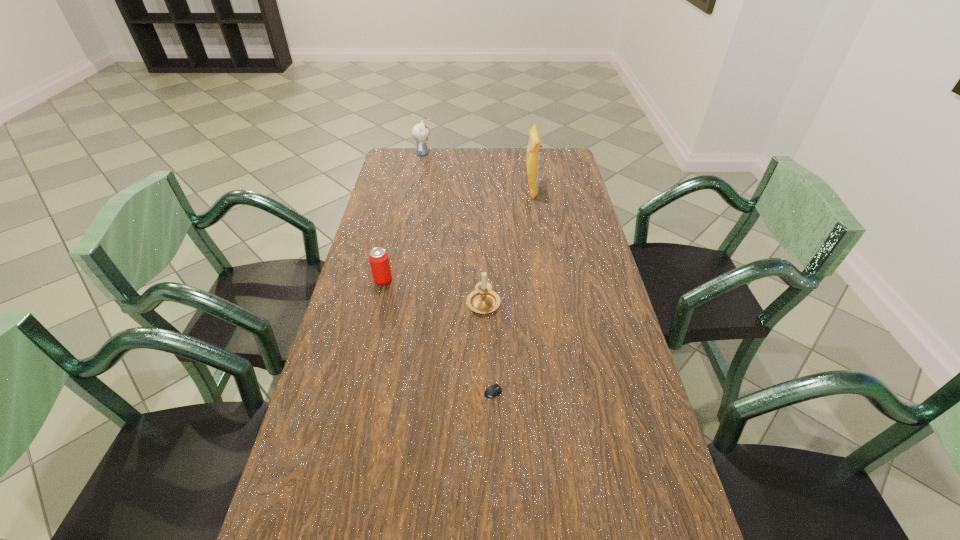
Find the location of a particular element. This screenshot has width=960, height=540. object at the far left corner is located at coordinates (420, 132).

I want to click on vacant space at the far edge of the desktop, so [x=478, y=159].

In order to click on vacant position at the left edge of the desktop in this screenshot , I will do `click(349, 524)`.

The image size is (960, 540). Identify the location of free space at the right edge of the desktop. (561, 177).

Locate an element on the screen. vacant point at the far left corner is located at coordinates (418, 167).

Identify the location of vacant area that lies between the beer can and the fourth farthest object. (433, 291).

Identify the location of unoccupied area between the beer can and the mouse. This screenshot has width=960, height=540. (444, 335).

Locate an element on the screen. Image resolution: width=960 pixels, height=540 pixels. free point between the crisp (potato chip) and the kitten is located at coordinates (477, 171).

Identify the location of free space between the second farthest object and the beer can. The height and width of the screenshot is (540, 960). (458, 235).

You are a GUI agent. You are given a task and a screenshot of the screen. Output one action in this format:
    pyautogui.click(x=<x>, y=<y>)
    Task: Click on the vacant space in between the beer can and the mouse
    The height and width of the screenshot is (540, 960).
    Given the screenshot: What is the action you would take?
    pyautogui.click(x=444, y=335)